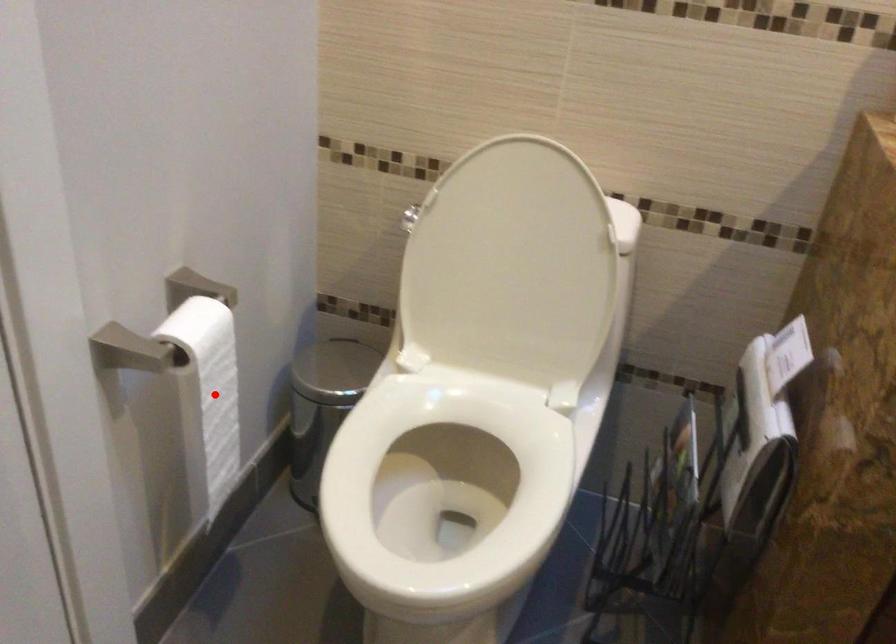
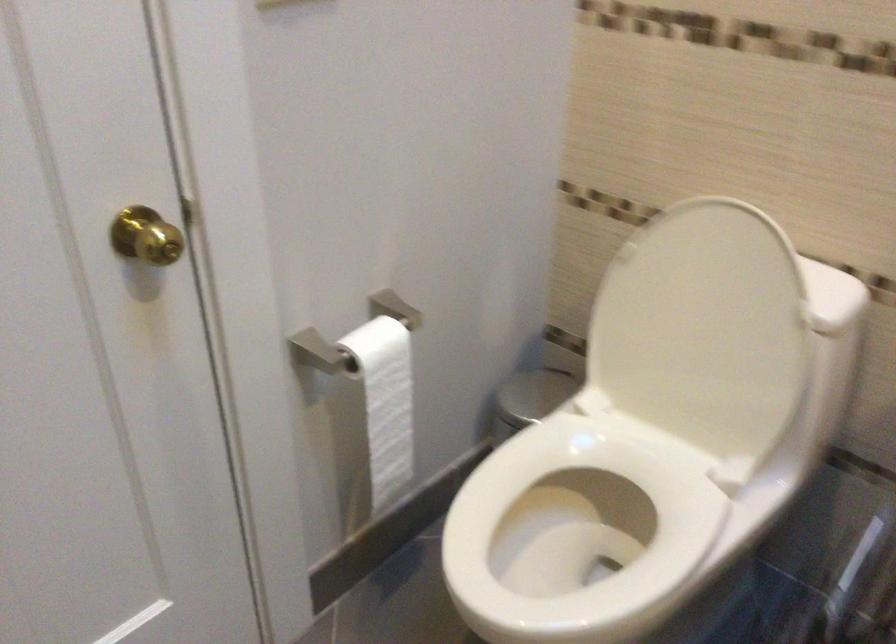
Find the pixel in the second image that matches the highlighted location in the first image.

(385, 402)